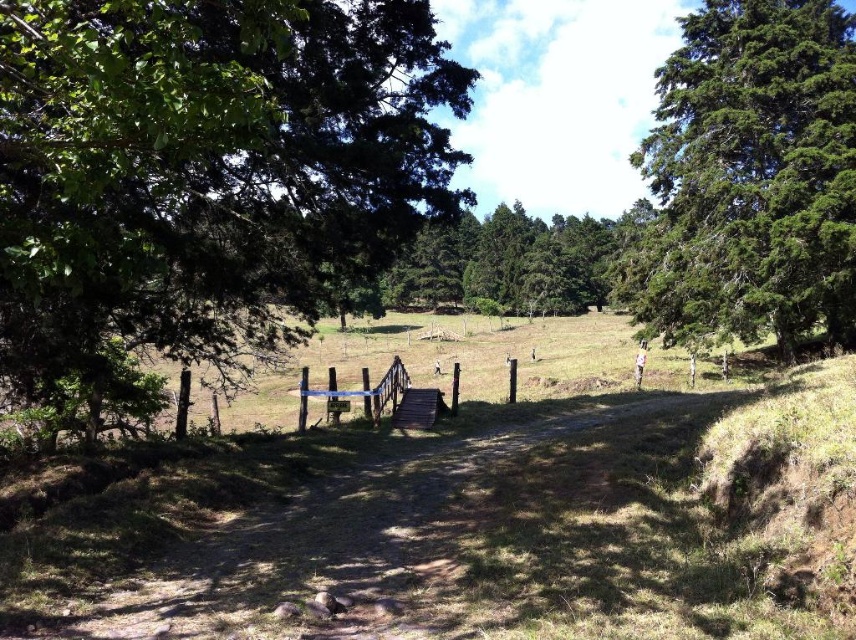
Looking at this image, you are a hiker who wants to take a photo of both the green leafy tree at left and the green textured tree at right. Which tree should you move closer to in order to capture both trees in the same frame?

You should move closer to the green textured tree at right because the green leafy tree at left is closer to the viewer, so moving towards the farther tree will help balance their sizes in the photo.

You are a hiker walking along the dirt path at center. You notice a green textured tree at right. Which object is taller in the scene?

The green textured tree at right is taller than the dirt path at center.

You are a hiker trying to cross the wooden bridge. You are currently standing on the dirt path at center. Which direction should you walk to reach the bridge?

The dirt path at center leads directly to the wooden bridge since the bridge is positioned centrally in the image, so you should continue walking straight ahead along the dirt path at center to reach the bridge.